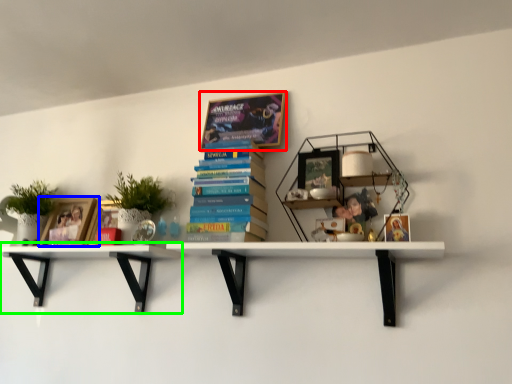
Question: Considering the real-world distances, which object is farthest from book (highlighted by a red box)? book cover (highlighted by a blue box) or shelf (highlighted by a green box)?

Choices:
 (A) book cover
 (B) shelf

Answer: (A)